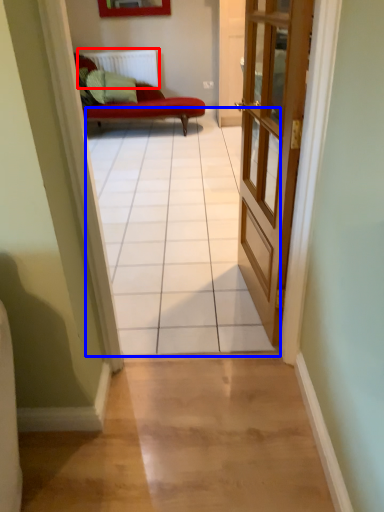
Question: Which of the following is the farthest to the observer, radiator (highlighted by a red box) or path (highlighted by a blue box)?

Choices:
 (A) radiator
 (B) path

Answer: (A)